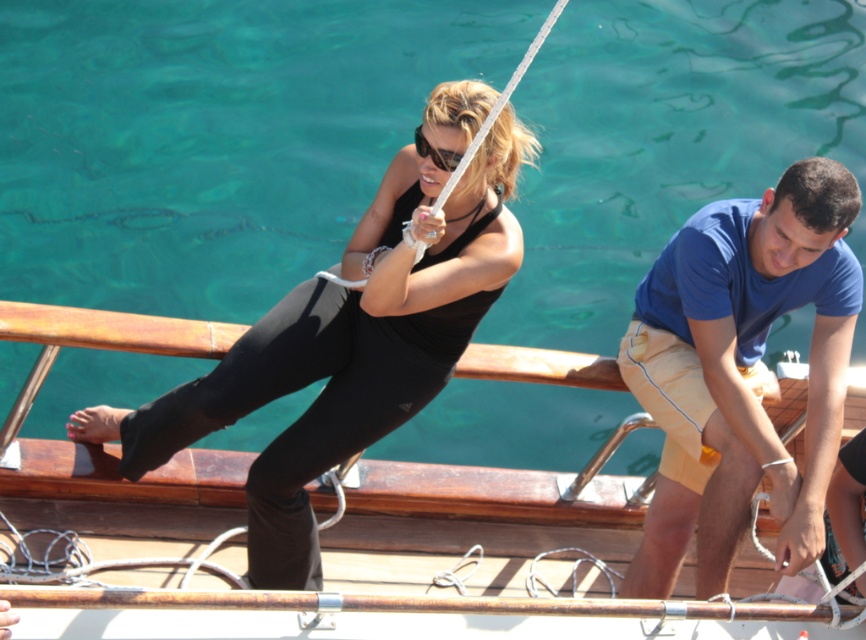
Who is positioned more to the right, clear blue water at center or black plastic goggles at center?

Positioned to the right is clear blue water at center.

Looking at this image, is clear blue water at center to the right of black plastic goggles at center from the viewer's perspective?

Correct, you'll find clear blue water at center to the right of black plastic goggles at center.

Is point (713, 28) less distant than point (444, 157)?

No, it is behind (444, 157).

You are a GUI agent. You are given a task and a screenshot of the screen. Output one action in this format:
    pyautogui.click(x=<x>, y=<y>)
    Task: Click on the clear blue water at center
    Image resolution: width=866 pixels, height=640 pixels.
    Given the screenshot: What is the action you would take?
    pyautogui.click(x=212, y=138)

Who is taller, wooden deck at center or blue cotton t-shirt at right?

With more height is blue cotton t-shirt at right.

Can you confirm if wooden deck at center is thinner than blue cotton t-shirt at right?

In fact, wooden deck at center might be wider than blue cotton t-shirt at right.

Is point (346, 576) closer to camera compared to point (857, 305)?

Yes.

Image resolution: width=866 pixels, height=640 pixels. In order to click on wooden deck at center in this screenshot , I will do `click(470, 536)`.

Which is more to the right, wooden deck at center or black plastic goggles at center?

Positioned to the right is wooden deck at center.

Is wooden deck at center bigger than black plastic goggles at center?

Yes.

Does point (434, 552) come farther from viewer compared to point (419, 132)?

Yes, it is.

Locate an element on the screen. wooden deck at center is located at coordinates (470, 536).